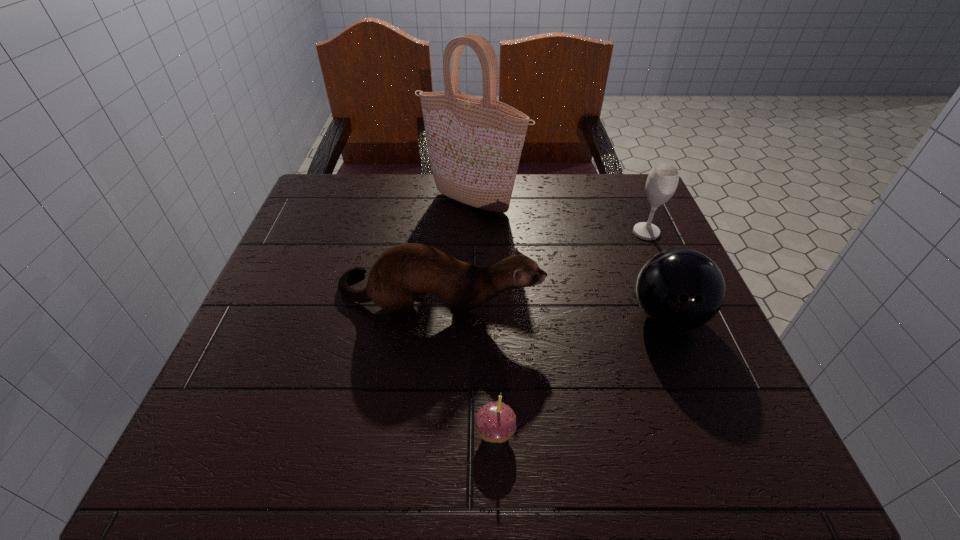
Identify the location of vacant space located 0.190m on the side of the bowling ball with the finger holes. (719, 446).

You are a GUI agent. You are given a task and a screenshot of the screen. Output one action in this format:
    pyautogui.click(x=<x>, y=<y>)
    Task: Click on the vacant space located 0.200m on the left of the nearest object
    The width and height of the screenshot is (960, 540).
    Given the screenshot: What is the action you would take?
    pyautogui.click(x=350, y=432)

This screenshot has width=960, height=540. What are the coordinates of `shopping bag that is at the far edge` in the screenshot? It's located at (474, 144).

This screenshot has height=540, width=960. What are the coordinates of `wineglass that is positioned at the far edge` in the screenshot? It's located at (662, 181).

The width and height of the screenshot is (960, 540). I want to click on object situated at the near edge, so click(x=495, y=422).

The height and width of the screenshot is (540, 960). In order to click on object at the left edge in this screenshot , I will do `click(410, 269)`.

The height and width of the screenshot is (540, 960). I want to click on wineglass at the right edge, so click(x=662, y=181).

I want to click on bowling ball that is positioned at the right edge, so click(681, 289).

Identify the location of object located in the far right corner section of the desktop. This screenshot has height=540, width=960. (662, 181).

The width and height of the screenshot is (960, 540). I want to click on vacant area at the far edge, so click(570, 193).